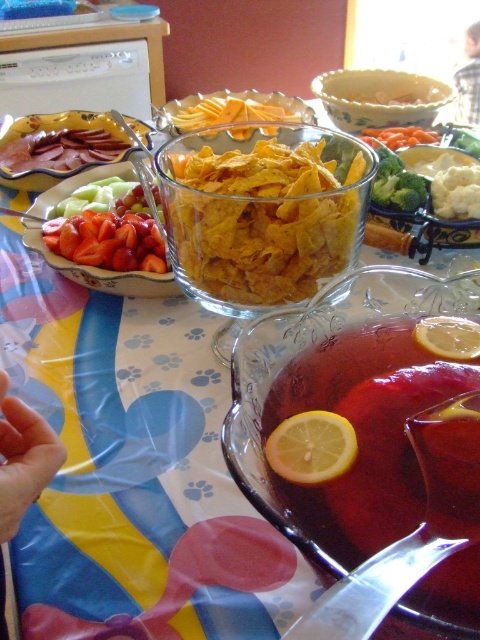
Can you confirm if yellow crispy chips at center is bigger than yellow matte lemon at center?

Indeed, yellow crispy chips at center has a larger size compared to yellow matte lemon at center.

Is the position of yellow crispy chips at center more distant than that of yellow matte lemon at center?

That is True.

Is point (203, 124) positioned behind point (454, 323)?

Yes, it is behind point (454, 323).

You are a GUI agent. You are given a task and a screenshot of the screen. Output one action in this format:
    pyautogui.click(x=<x>, y=<y>)
    Task: Click on the yellow crispy chips at center
    The image size is (480, 640).
    Given the screenshot: What is the action you would take?
    pyautogui.click(x=240, y=112)

Who is shorter, yellow matte lemon at center or orange smoothie at center?

yellow matte lemon at center is shorter.

How distant is yellow matte lemon at center from orange smoothie at center?

yellow matte lemon at center is 10.97 inches from orange smoothie at center.

Is point (434, 332) closer to camera compared to point (375, 138)?

Yes, it is.

You are a GUI agent. You are given a task and a screenshot of the screen. Output one action in this format:
    pyautogui.click(x=<x>, y=<y>)
    Task: Click on the yellow matte lemon at center
    The image size is (480, 640).
    Given the screenshot: What is the action you would take?
    pyautogui.click(x=448, y=337)

Does yellow matte corn chips at center appear on the left side of white creamy mashed potatoes at center?

Yes, yellow matte corn chips at center is to the left of white creamy mashed potatoes at center.

You are a GUI agent. You are given a task and a screenshot of the screen. Output one action in this format:
    pyautogui.click(x=<x>, y=<y>)
    Task: Click on the yellow matte corn chips at center
    
    Given the screenshot: What is the action you would take?
    click(x=263, y=211)

What do you see at coordinates (263, 211) in the screenshot? Image resolution: width=480 pixels, height=640 pixels. I see `yellow matte corn chips at center` at bounding box center [263, 211].

I want to click on yellow matte corn chips at center, so click(x=263, y=211).